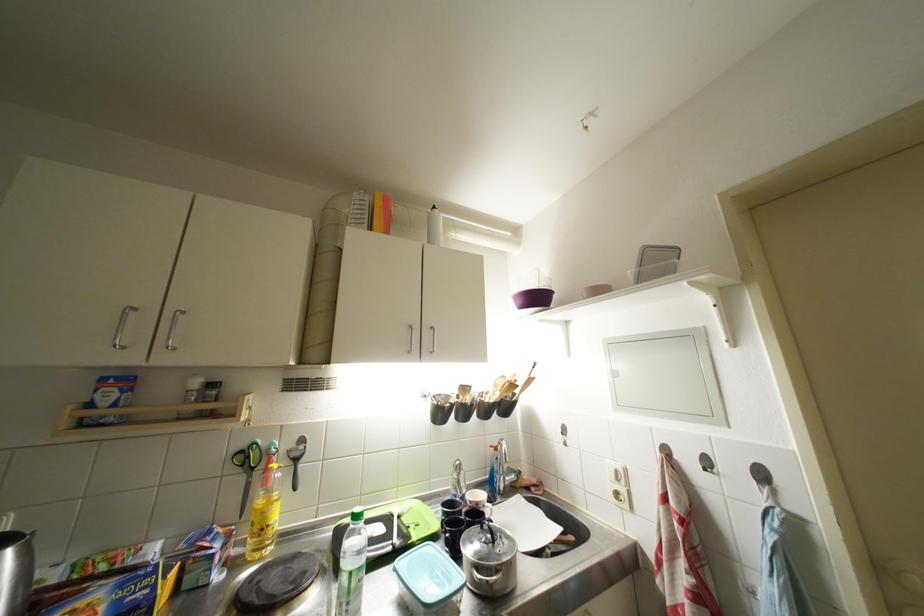
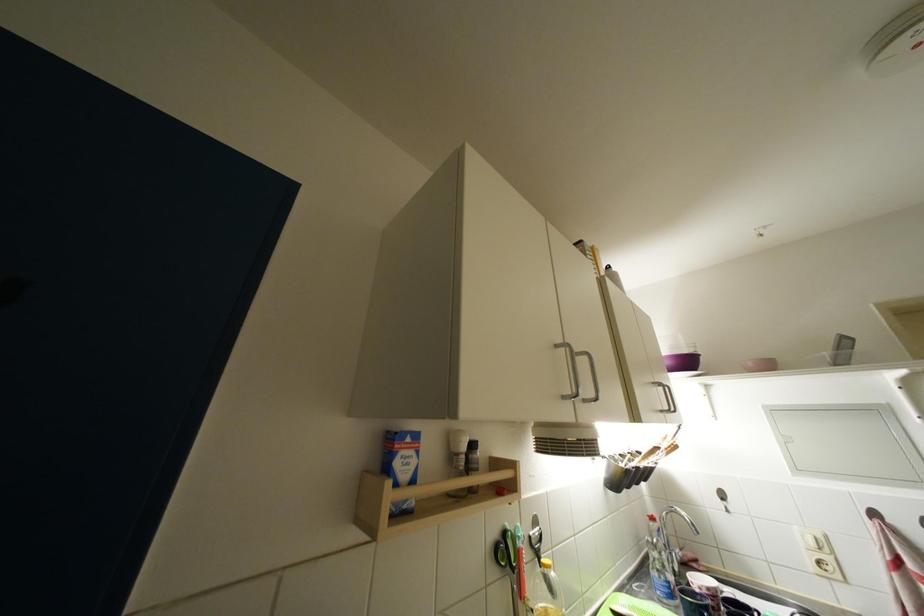
Locate, in the second image, the point that corresponds to pixel 527 306 in the first image.

(675, 367)